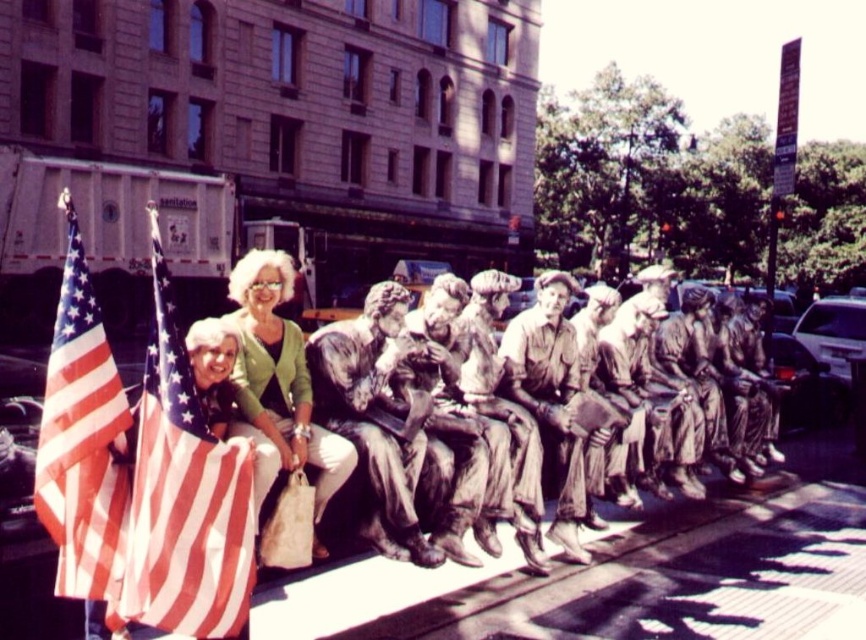
Between point (207, 573) and point (107, 452), which one is positioned behind?

Positioned behind is point (107, 452).

Measure the distance between point (214, 508) and camera.

Point (214, 508) and camera are 3.41 meters apart.

In order to click on american flag at left in this screenshot , I will do `click(185, 496)`.

Which is more to the right, american flag at left or matte green sweater at center?

From the viewer's perspective, matte green sweater at center appears more on the right side.

Does point (179, 406) lie in front of point (270, 266)?

Yes, it is in front of point (270, 266).

You are a GUI agent. You are given a task and a screenshot of the screen. Output one action in this format:
    pyautogui.click(x=<x>, y=<y>)
    Task: Click on the american flag at left
    
    Given the screenshot: What is the action you would take?
    pyautogui.click(x=185, y=496)

Is bronze statue at center smaller than matte green sweater at center?

No.

Does bronze statue at center have a lesser width compared to matte green sweater at center?

No, bronze statue at center is not thinner than matte green sweater at center.

Is point (574, 536) farther from viewer compared to point (276, 260)?

Yes, point (574, 536) is farther from viewer.

You are a GUI agent. You are given a task and a screenshot of the screen. Output one action in this format:
    pyautogui.click(x=<x>, y=<y>)
    Task: Click on the bronze statue at center
    
    Given the screenshot: What is the action you would take?
    pyautogui.click(x=534, y=388)